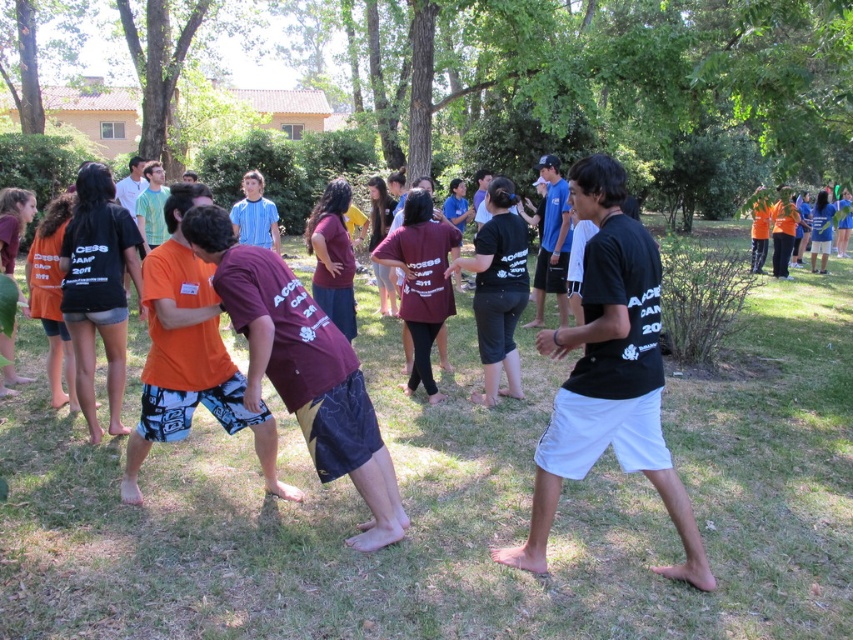
Locate an element on the screen. green grass at center is located at coordinates (460, 508).

Between point (10, 436) and point (614, 340), which one is positioned behind?

Positioned behind is point (10, 436).

The image size is (853, 640). In order to click on green grass at center in this screenshot , I will do `click(460, 508)`.

Consider the image. Between green grass at center and orange t-shirt at upper right, which one has less height?

With less height is green grass at center.

Does green grass at center have a larger size compared to orange t-shirt at upper right?

Yes.

I want to click on green grass at center, so click(460, 508).

Which is below, black matte shirt at center or orange t-shirt at upper right?

black matte shirt at center is below.

Between point (659, 401) and point (799, 232), which one is positioned behind?

Point (799, 232)

I want to click on black matte shirt at center, so click(608, 376).